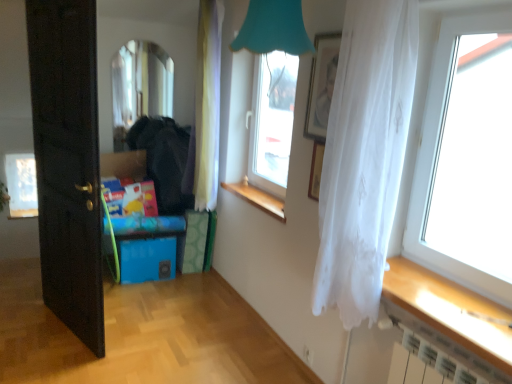
Question: From the image's perspective, is blue plastic storage box at lower left under transparent fabric curtain at right?

Choices:
 (A) yes
 (B) no

Answer: (A)

Question: From the image's perspective, is blue plastic storage box at lower left above transparent fabric curtain at right?

Choices:
 (A) yes
 (B) no

Answer: (B)

Question: Is blue plastic storage box at lower left beside transparent fabric curtain at right?

Choices:
 (A) yes
 (B) no

Answer: (B)

Question: Is transparent fabric curtain at right surrounded by blue plastic storage box at lower left?

Choices:
 (A) no
 (B) yes

Answer: (A)

Question: Considering the relative positions of blue plastic storage box at lower left and transparent fabric curtain at right in the image provided, is blue plastic storage box at lower left behind transparent fabric curtain at right?

Choices:
 (A) yes
 (B) no

Answer: (A)

Question: In terms of width, does matte silver picture frame at upper center look wider or thinner when compared to white sheer curtain at center, which appears as the second curtain when viewed from the right?

Choices:
 (A) wide
 (B) thin

Answer: (B)

Question: From a real-world perspective, relative to white sheer curtain at center, the 1th curtain viewed from the left, is matte silver picture frame at upper center vertically above or below?

Choices:
 (A) above
 (B) below

Answer: (A)

Question: Considering the positions of matte silver picture frame at upper center and white sheer curtain at center, the 2th curtain in the front-to-back sequence, in the image, is matte silver picture frame at upper center bigger or smaller than white sheer curtain at center, the 2th curtain in the front-to-back sequence,?

Choices:
 (A) big
 (B) small

Answer: (B)

Question: Considering the positions of point (305, 127) and point (197, 127), is point (305, 127) closer or farther from the camera than point (197, 127)?

Choices:
 (A) farther
 (B) closer

Answer: (B)

Question: Considering the relative positions of transparent glass window at right, acting as the 1th window starting from the front, and transparent glass window at center, the third window viewed from the back, in the image provided, is transparent glass window at right, acting as the 1th window starting from the front, to the left or to the right of transparent glass window at center, the third window viewed from the back,?

Choices:
 (A) right
 (B) left

Answer: (A)

Question: In the image, is transparent glass window at right, which appears as the fourth window when viewed from the back, positioned in front of or behind transparent glass window at center, the third window viewed from the back?

Choices:
 (A) front
 (B) behind

Answer: (A)

Question: In terms of size, does transparent glass window at right, the 4th window positioned from the left, appear bigger or smaller than transparent glass window at center, arranged as the second window when viewed from the front?

Choices:
 (A) big
 (B) small

Answer: (B)

Question: Is transparent glass window at right, which ranks as the first window in right-to-left order, wider or thinner than transparent glass window at center, arranged as the second window when viewed from the front?

Choices:
 (A) wide
 (B) thin

Answer: (B)

Question: In the image, is clear glass mirror at upper left, which ranks as the 3th window in right-to-left order, on the left side or the right side of wooden at center?

Choices:
 (A) left
 (B) right

Answer: (A)

Question: Would you say clear glass mirror at upper left, which ranks as the 2th window in left-to-right order, is inside or outside wooden at center?

Choices:
 (A) outside
 (B) inside

Answer: (A)